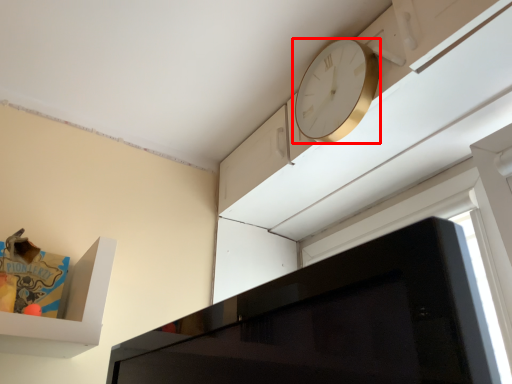
Question: From the image, what is the correct spatial relationship of clock (annotated by the red box) in relation to window?

Choices:
 (A) left
 (B) right

Answer: (A)